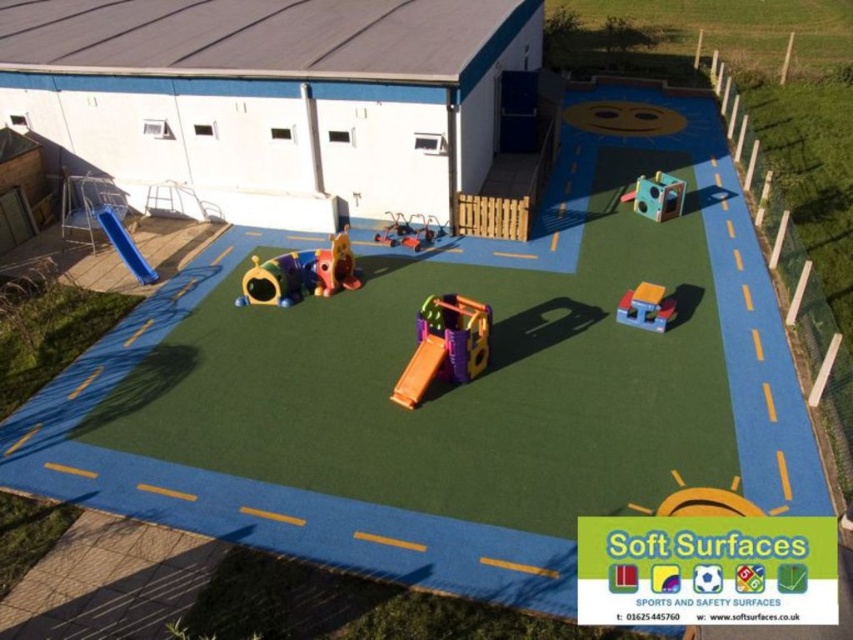
Does point (252, 280) lie behind point (415, 228)?

No.

Find the location of `matte yellow tunnel at center`. matte yellow tunnel at center is located at coordinates (271, 282).

Between point (294, 269) and point (430, 220), which one is positioned in front?

Point (294, 269) is in front.

The height and width of the screenshot is (640, 853). Identify the location of matte yellow tunnel at center. (271, 282).

This screenshot has height=640, width=853. I want to click on matte multicolored cube at upper right, so click(x=656, y=196).

Is matte multicolored cube at upper right to the right of rubberized yellow slide at center from the viewer's perspective?

Correct, you'll find matte multicolored cube at upper right to the right of rubberized yellow slide at center.

You are a GUI agent. You are given a task and a screenshot of the screen. Output one action in this format:
    pyautogui.click(x=<x>, y=<y>)
    Task: Click on the matte multicolored cube at upper right
    The image size is (853, 640).
    Given the screenshot: What is the action you would take?
    pyautogui.click(x=656, y=196)

Between orange plastic slide at center and rubberized plastic playhouse at center, which one is positioned lower?

orange plastic slide at center

Does point (433, 365) come in front of point (643, 305)?

Yes, it is in front of point (643, 305).

Is point (430, 336) less distant than point (646, 300)?

Yes.

The height and width of the screenshot is (640, 853). In order to click on orange plastic slide at center in this screenshot , I will do `click(419, 371)`.